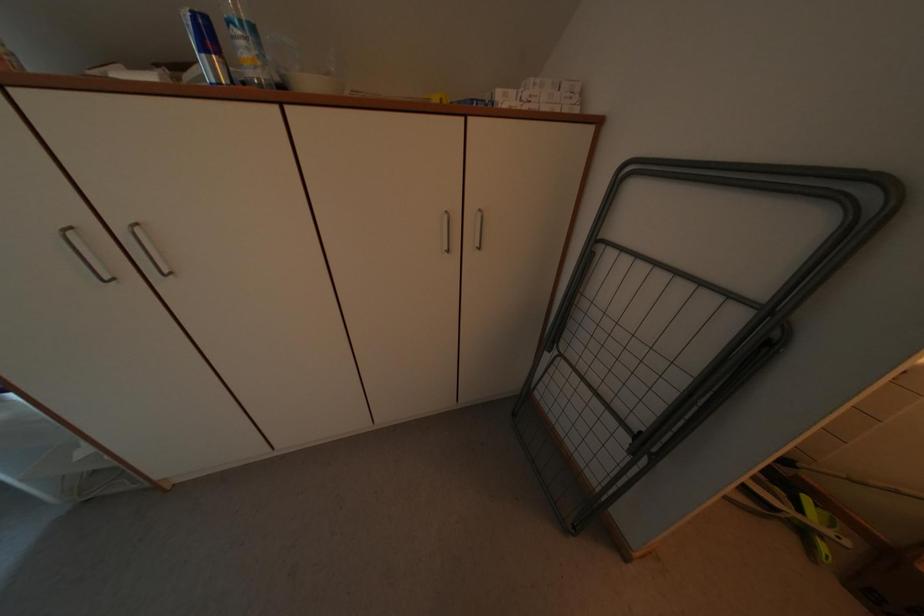
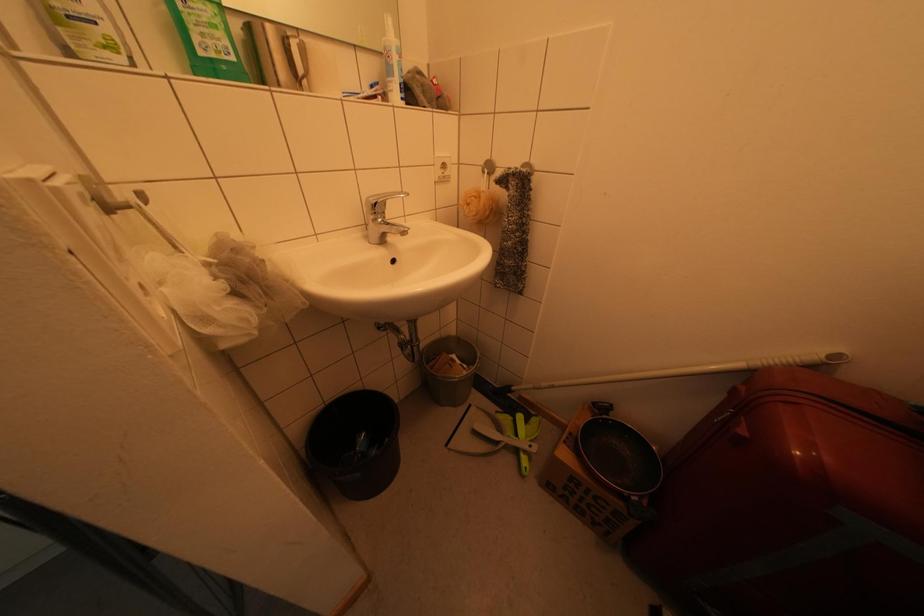
Question: The camera is either moving clockwise (left) or counter-clockwise (right) around the object. The first image is from the beginning of the video and the second image is from the end. Is the camera moving left or right when shooting the video?

Choices:
 (A) Left
 (B) Right

Answer: (A)